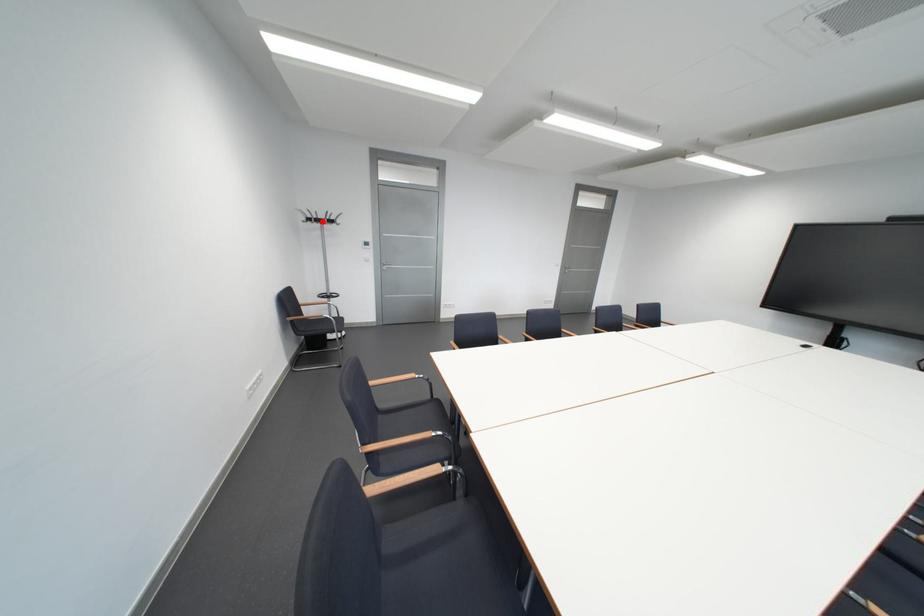
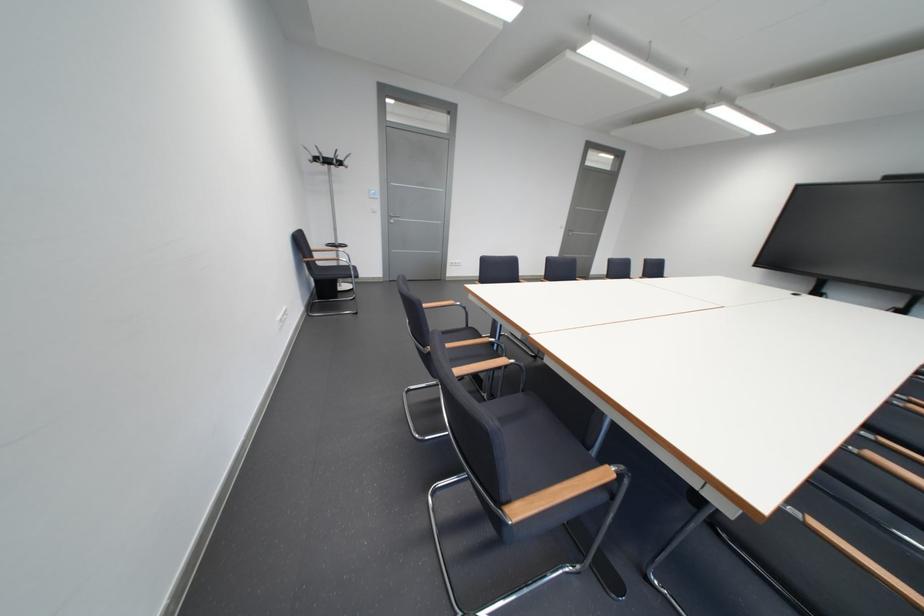
Find the pixel in the second image that matches the highlighted location in the first image.

(330, 161)